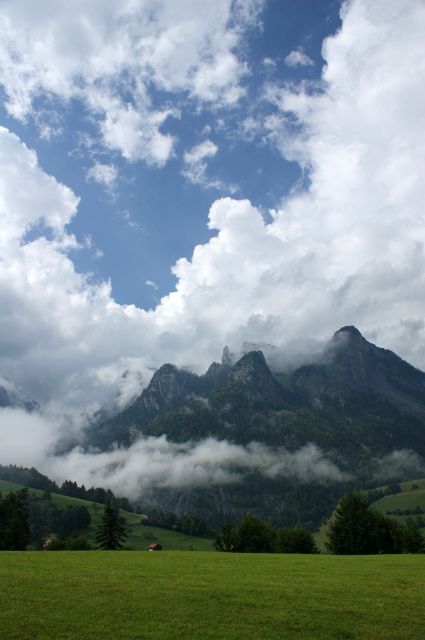
Which of these two, white fluffy cloud at upper center or green grassy field at lower center, stands taller?

Standing taller between the two is white fluffy cloud at upper center.

Is white fluffy cloud at upper center shorter than green grassy field at lower center?

In fact, white fluffy cloud at upper center may be taller than green grassy field at lower center.

Locate an element on the screen. white fluffy cloud at upper center is located at coordinates (204, 184).